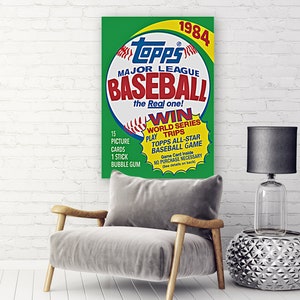
I want to click on baseboard, so (32, 262).